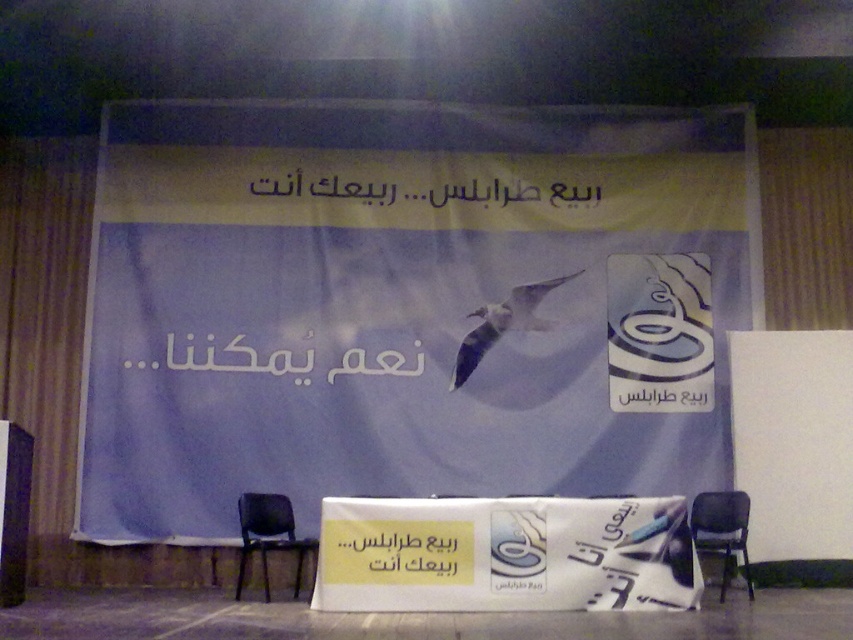
Question: Which of the following is the closest to the observer?

Choices:
 (A) (460, 372)
 (B) (720, 506)
 (C) (503, 550)

Answer: (C)

Question: Can you confirm if black plastic chair at lower left is thinner than white glossy bird at center?

Choices:
 (A) yes
 (B) no

Answer: (A)

Question: Does white glossy bird at center appear on the right side of black plastic chair at lower right?

Choices:
 (A) no
 (B) yes

Answer: (A)

Question: Which point appears farthest from the camera in this image?

Choices:
 (A) [x=270, y=513]
 (B) [x=532, y=518]
 (C) [x=517, y=324]

Answer: (C)

Question: Which point appears closest to the camera in this image?

Choices:
 (A) (526, 308)
 (B) (712, 515)
 (C) (289, 504)

Answer: (B)

Question: Can you confirm if white glossy banner at center is smaller than white glossy bird at center?

Choices:
 (A) yes
 (B) no

Answer: (B)